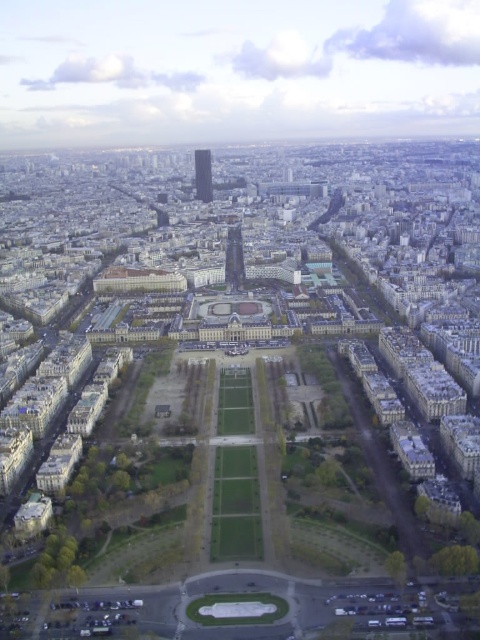
Question: Is shiny metallic eiffel tower at center smaller than smooth glass skyscraper at center?

Choices:
 (A) no
 (B) yes

Answer: (A)

Question: Does shiny metallic eiffel tower at center appear over smooth glass skyscraper at center?

Choices:
 (A) yes
 (B) no

Answer: (B)

Question: Which point appears closest to the camera in this image?

Choices:
 (A) (208, 177)
 (B) (243, 276)

Answer: (B)

Question: Which point is farther from the camera taking this photo?

Choices:
 (A) (202, 192)
 (B) (232, 236)

Answer: (A)

Question: Does shiny metallic eiffel tower at center lie behind smooth glass skyscraper at center?

Choices:
 (A) no
 (B) yes

Answer: (A)